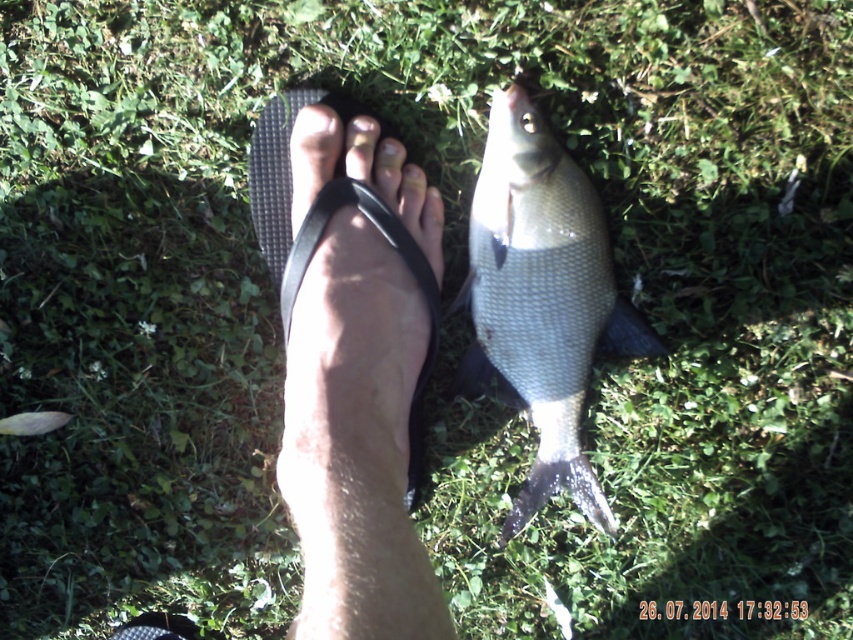
Question: Which of the following is the farthest from the observer?

Choices:
 (A) (289, 132)
 (B) (364, 138)

Answer: (A)

Question: Can you confirm if black rubber flip-flop at center is thinner than matte black toe at center?

Choices:
 (A) yes
 (B) no

Answer: (B)

Question: Which object is the closest to the matte black toe at center?

Choices:
 (A) shiny silver fish at center
 (B) black rubber flip-flop at center

Answer: (B)

Question: Is black rubber flip-flop at center bigger than matte black toe at center?

Choices:
 (A) yes
 (B) no

Answer: (A)

Question: Can you confirm if shiny silver fish at center is thinner than black rubber flip-flop at center?

Choices:
 (A) no
 (B) yes

Answer: (A)

Question: Which object is closer to the camera taking this photo?

Choices:
 (A) shiny silver fish at center
 (B) matte black toe at center
 (C) black rubber flip-flop at center

Answer: (C)